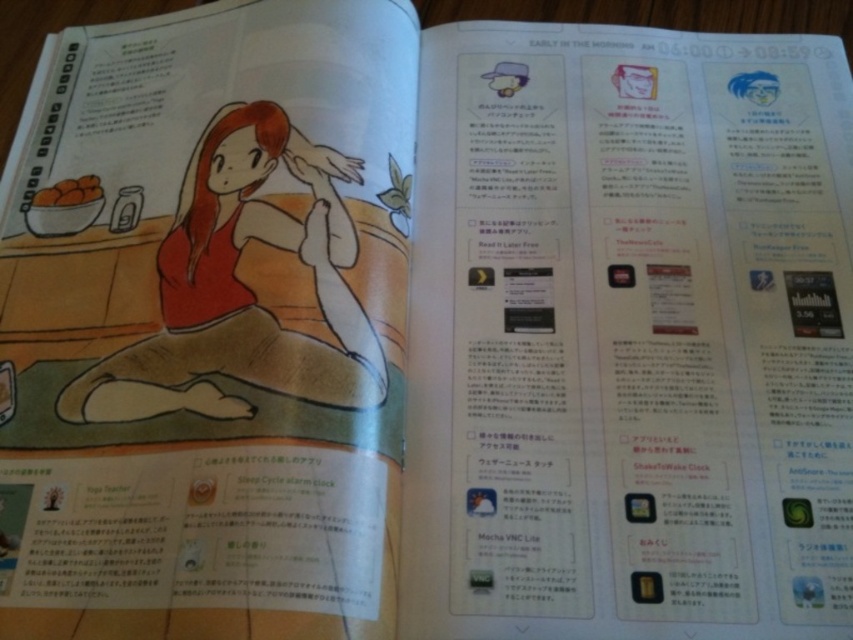
Is point (199, 385) closer to viewer compared to point (50, 189)?

Yes, point (199, 385) is in front of point (50, 189).

At what (x,y) coordinates should I click in order to perform the action: click on matte red dress at center. Please return your answer as a coordinate pair (x, y). Looking at the image, I should click on (242, 288).